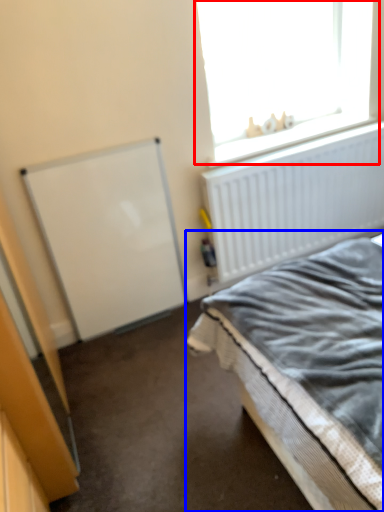
Question: Which object appears farthest to the camera in this image, window (highlighted by a red box) or bed (highlighted by a blue box)?

Choices:
 (A) window
 (B) bed

Answer: (A)